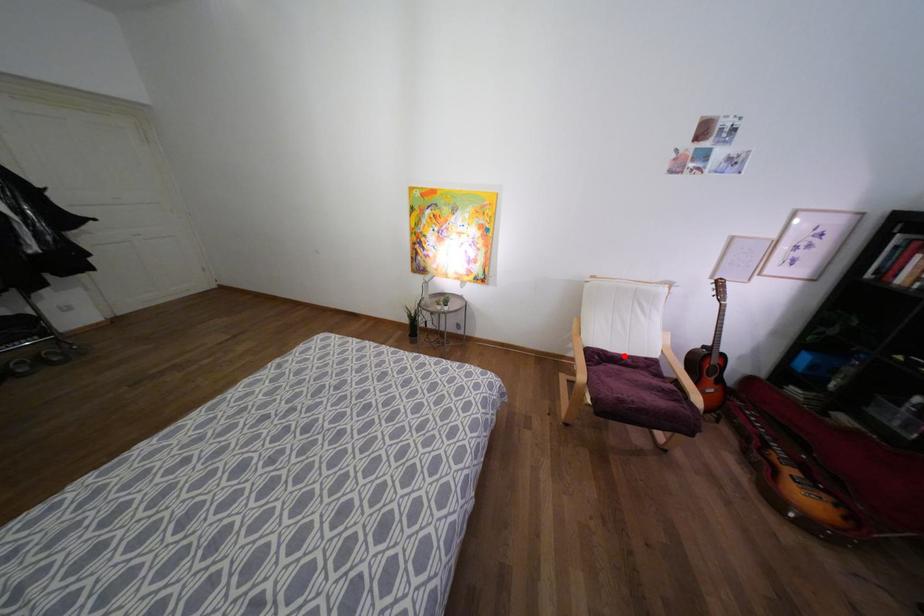
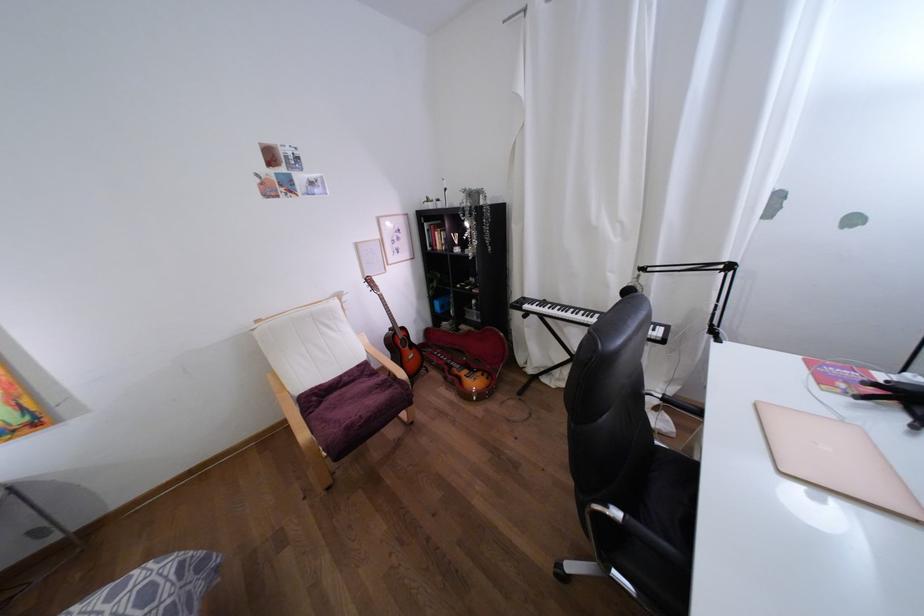
Where in the second image is the point corresponding to the highlighted location from the first image?

(339, 377)